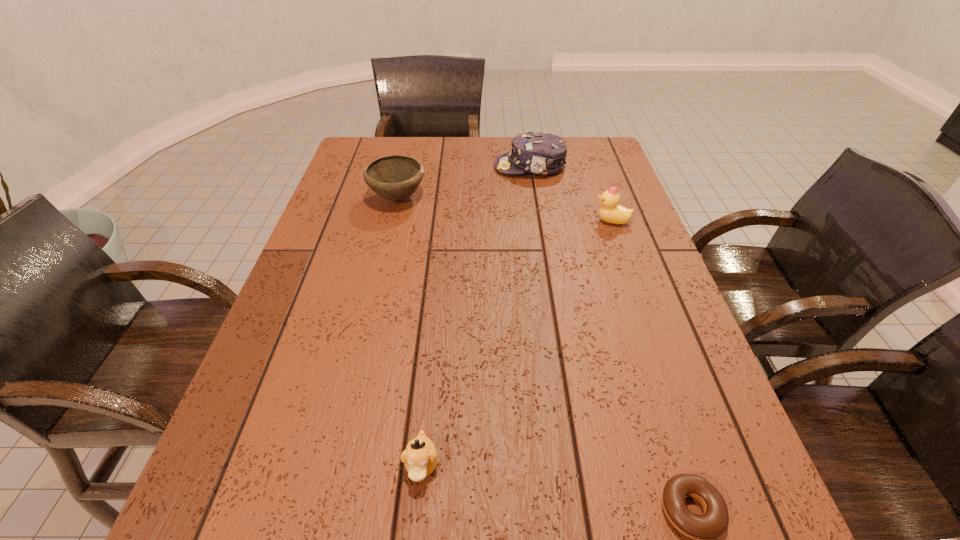
You are a GUI agent. You are given a task and a screenshot of the screen. Output one action in this format:
    pyautogui.click(x=<x>, y=<y>)
    Task: Click on the third object from right to left
    
    Given the screenshot: What is the action you would take?
    pyautogui.click(x=540, y=153)

Locate an element on the screen. The height and width of the screenshot is (540, 960). headwear is located at coordinates (540, 153).

The height and width of the screenshot is (540, 960). What are the coordinates of `the right duckling` in the screenshot? It's located at (611, 212).

At what (x,y) coordinates should I click in order to perform the action: click on the farther duckling. Please return your answer as a coordinate pair (x, y). The width and height of the screenshot is (960, 540). Looking at the image, I should click on (611, 212).

I want to click on bowl, so (395, 178).

The width and height of the screenshot is (960, 540). Find the location of `the nearer duckling`. the nearer duckling is located at coordinates (420, 457).

Where is `the left duckling`? The width and height of the screenshot is (960, 540). the left duckling is located at coordinates (420, 457).

Find the location of a particular element. The width and height of the screenshot is (960, 540). free spot located on the front-facing side of the farthest object is located at coordinates (375, 167).

Find the location of a particular element. free space located on the front-facing side of the farthest object is located at coordinates (372, 167).

Where is `vacant space located on the front-facing side of the farthest object`? The height and width of the screenshot is (540, 960). vacant space located on the front-facing side of the farthest object is located at coordinates click(x=475, y=167).